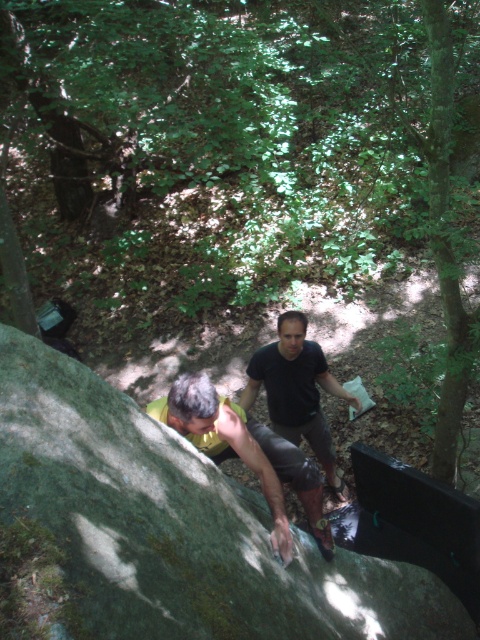
Question: Is green mossy rock at lower left wider than black matte shirt at center?

Choices:
 (A) yes
 (B) no

Answer: (B)

Question: Can you confirm if green mossy rock at center is bigger than black matte shirt at center?

Choices:
 (A) yes
 (B) no

Answer: (A)

Question: Which point is farther to the camera?

Choices:
 (A) (276, 512)
 (B) (292, 419)
 (C) (165, 432)

Answer: (B)

Question: Which point is closer to the camera?

Choices:
 (A) (304, 392)
 (B) (160, 413)
 (C) (238, 628)

Answer: (C)

Question: Among these objects, which one is farthest from the camera?

Choices:
 (A) green mossy rock at center
 (B) black matte shirt at center
 (C) green mossy rock at lower left

Answer: (B)

Question: From the image, what is the correct spatial relationship of green mossy rock at lower left in relation to black matte shirt at center?

Choices:
 (A) below
 (B) above

Answer: (A)